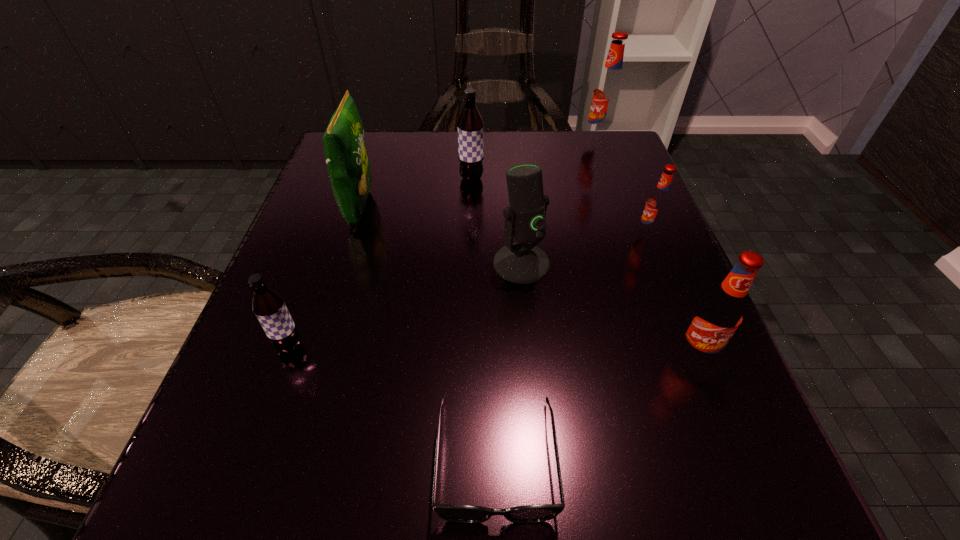
In the image, there is a desktop. Where is `vacant space at the near left corner`? vacant space at the near left corner is located at coordinates (249, 522).

This screenshot has width=960, height=540. Identify the location of vacant space at the far right corner of the desktop. (556, 140).

Where is `free space that is in between the tallest root beer and the fourth root beer from right to left`? free space that is in between the tallest root beer and the fourth root beer from right to left is located at coordinates (535, 160).

You are a GUI agent. You are given a task and a screenshot of the screen. Output one action in this format:
    pyautogui.click(x=<x>, y=<y>)
    Task: Click on the empty location between the microphone and the nearest red root beer
    The height and width of the screenshot is (540, 960).
    Given the screenshot: What is the action you would take?
    pyautogui.click(x=609, y=308)

Where is `free space that is in between the green crisp (potato chip) and the fourth nearest root beer`? Image resolution: width=960 pixels, height=540 pixels. free space that is in between the green crisp (potato chip) and the fourth nearest root beer is located at coordinates (416, 193).

The image size is (960, 540). In order to click on vacant area that lies between the microphone and the second root beer from left to right in this screenshot , I will do pos(496,221).

Where is `vacant area between the second nearest red root beer and the sunglasses`? The width and height of the screenshot is (960, 540). vacant area between the second nearest red root beer and the sunglasses is located at coordinates (572, 346).

Find the location of a particular element. This screenshot has height=540, width=960. unoccupied position between the farthest root beer and the left brown root beer is located at coordinates (444, 244).

Image resolution: width=960 pixels, height=540 pixels. What are the coordinates of `vacant space that's between the nearest red root beer and the nearer brown root beer` in the screenshot? It's located at (492, 350).

Locate an element on the screen. The height and width of the screenshot is (540, 960). empty location between the microphone and the left brown root beer is located at coordinates click(405, 305).